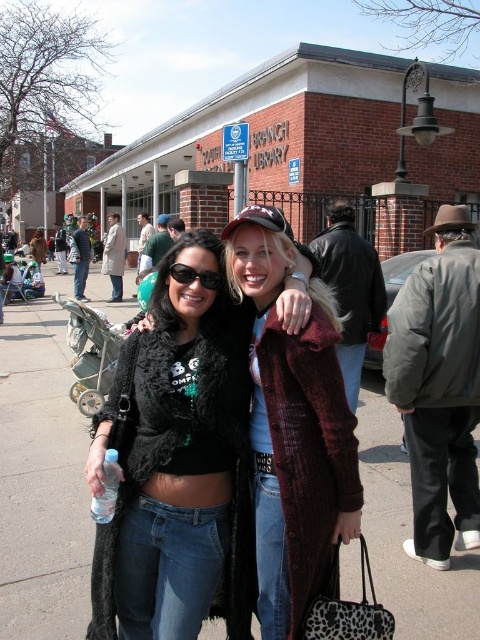
Does matte concrete sidewalk at center have a greater width compared to clear plastic bottle at lower left?

Yes.

From the picture: Between matte concrete sidewalk at center and clear plastic bottle at lower left, which one is positioned lower?

clear plastic bottle at lower left is lower down.

Does point (48, 451) come behind point (112, 486)?

That is True.

At what (x,y) coordinates should I click in order to perform the action: click on matte concrete sidewalk at center. Please return your answer as a coordinate pair (x, y). The height and width of the screenshot is (640, 480). Looking at the image, I should click on (41, 476).

Can you confirm if dark gray puffer jacket at right is thinner than clear plastic bottle at lower left?

In fact, dark gray puffer jacket at right might be wider than clear plastic bottle at lower left.

Is dark gray puffer jacket at right shorter than clear plastic bottle at lower left?

In fact, dark gray puffer jacket at right may be taller than clear plastic bottle at lower left.

Between point (399, 316) and point (93, 502), which one is positioned behind?

Positioned behind is point (399, 316).

Locate an element on the screen. Image resolution: width=480 pixels, height=640 pixels. dark gray puffer jacket at right is located at coordinates (439, 387).

Which of these two, black fuzzy cardigan at center or sunglasses at center, stands shorter?

With less height is sunglasses at center.

Does black fuzzy cardigan at center appear over sunglasses at center?

Incorrect, black fuzzy cardigan at center is not positioned above sunglasses at center.

Identify the location of black fuzzy cardigan at center. This screenshot has width=480, height=640. (179, 465).

Identify the location of black fuzzy cardigan at center. The image size is (480, 640). (179, 465).